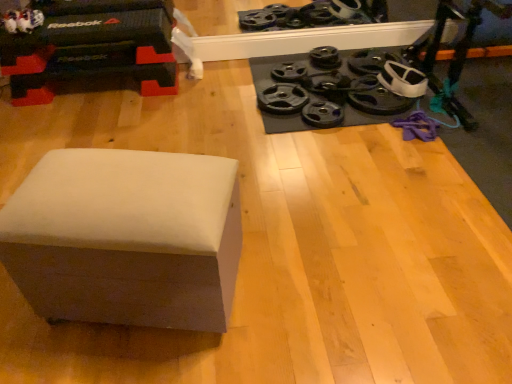
Identify the location of free spot above black rubber weight plate at center-right, placed as the seventh wheel when sorted from right to left (from a real-world perspective). (284, 95).